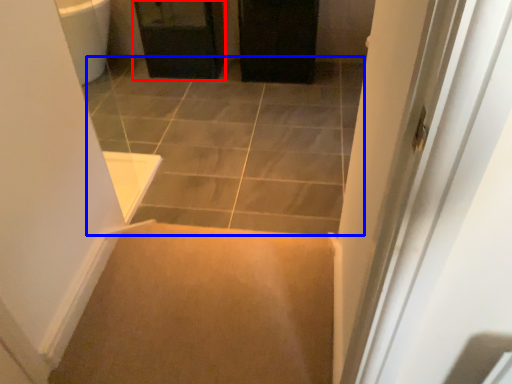
Question: Which of the following is the closest to the observer, cabinetry (highlighted by a red box) or path (highlighted by a blue box)?

Choices:
 (A) cabinetry
 (B) path

Answer: (B)